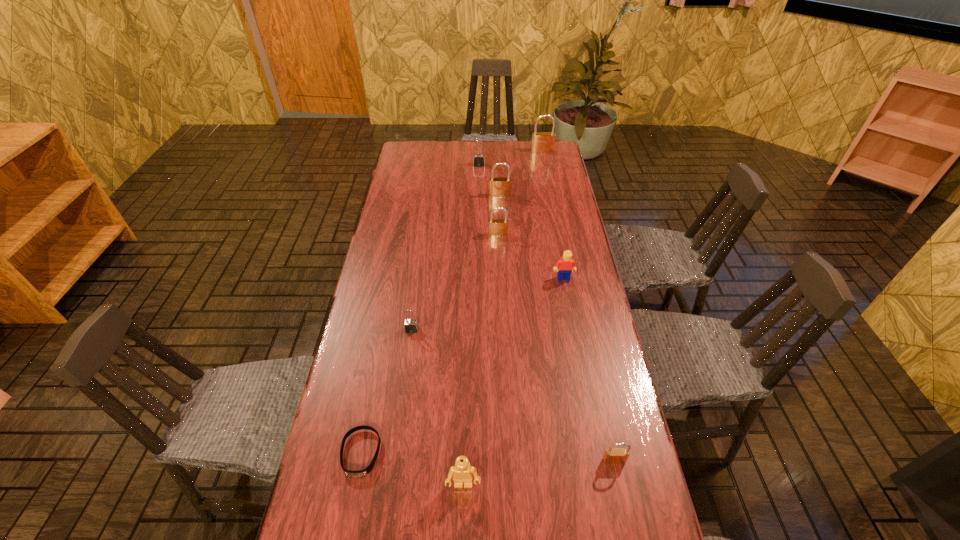
The image size is (960, 540). Find the location of `vacant space at the left edge`. vacant space at the left edge is located at coordinates (388, 213).

At what (x,y) coordinates should I click in order to perform the action: click on vacant space at the right edge. Please return your answer as a coordinate pair (x, y). Image resolution: width=960 pixels, height=540 pixels. Looking at the image, I should click on (565, 341).

What are the coordinates of `free space at the far left corner of the desktop` in the screenshot? It's located at (426, 151).

The image size is (960, 540). I want to click on vacant point located between the fifth farthest padlock and the shortest object, so click(386, 392).

Identify the location of free space between the nearer Lego and the second smallest brass padlock. (481, 359).

Where is `free space between the farthest padlock and the nearer Lego`? The height and width of the screenshot is (540, 960). free space between the farthest padlock and the nearer Lego is located at coordinates (503, 318).

Locate an element on the screen. free space that is in between the smallest brass padlock and the tallest object is located at coordinates (578, 306).

Identify the location of empty space that is in between the third smallest brass padlock and the farther Lego. (532, 237).

In order to click on vacant point located between the leftmost object and the farthest object in this screenshot , I will do `click(451, 302)`.

The width and height of the screenshot is (960, 540). Find the location of `vacant area that lies between the left Lego and the farthest padlock`. vacant area that lies between the left Lego and the farthest padlock is located at coordinates (503, 318).